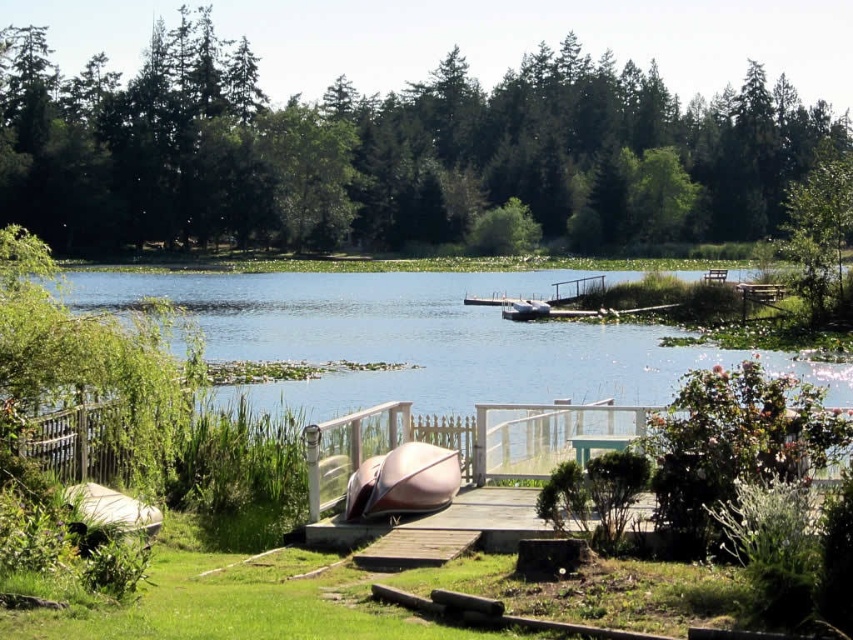
You are planning to set up a picnic blanket in the grassy area near the dock. Considering the shade provided by the green matte tree at upper center and the green leafy tree at upper right, which tree would offer more coverage for your picnic spot?

The green matte tree at upper center might provide more shade coverage than the green leafy tree at upper right due to its wider canopy.

You are standing at the lakeside and want to take a photo of both the wooden dock at center and the green leafy tree at upper right. Which object should you focus on first to ensure both are in frame?

You should focus on the wooden dock at center first because it is closer to the viewer than the green leafy tree at upper right, so adjusting the camera to include both would require starting with the closer object.